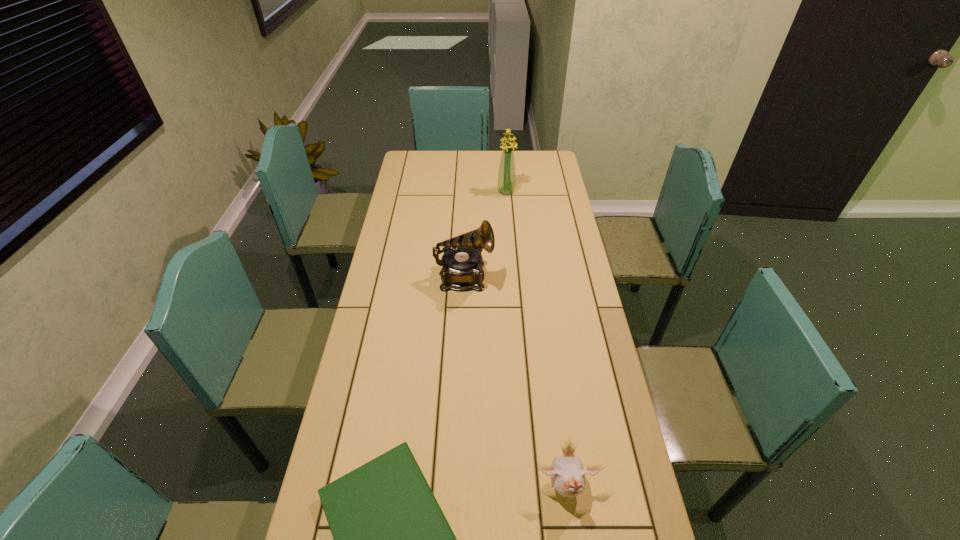
This screenshot has width=960, height=540. What are the coordinates of `vacant area at the far right corner` in the screenshot? It's located at (531, 163).

Image resolution: width=960 pixels, height=540 pixels. In order to click on vacant space in between the bird and the third nearest object in this screenshot , I will do `click(515, 383)`.

Identify the location of free space between the second shortest object and the bouquet. The image size is (960, 540). (536, 340).

Locate an element on the screen. object that can be found as the third closest to the third tallest object is located at coordinates (506, 183).

Identify which object is the second closest to the second shortest object. Please provide its 2D coordinates. Your answer should be formatted as a tuple, i.e. [(x, y)], where the tuple contains the x and y coordinates of a point satisfying the conditions above.

[(462, 261)]